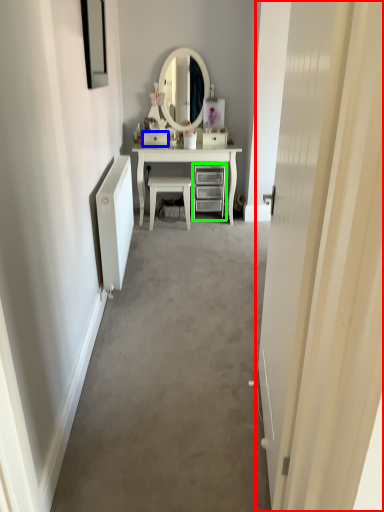
Question: Considering the real-world distances, which object is farthest from door (highlighted by a red box)? drawer (highlighted by a blue box) or chest of drawers (highlighted by a green box)?

Choices:
 (A) drawer
 (B) chest of drawers

Answer: (A)